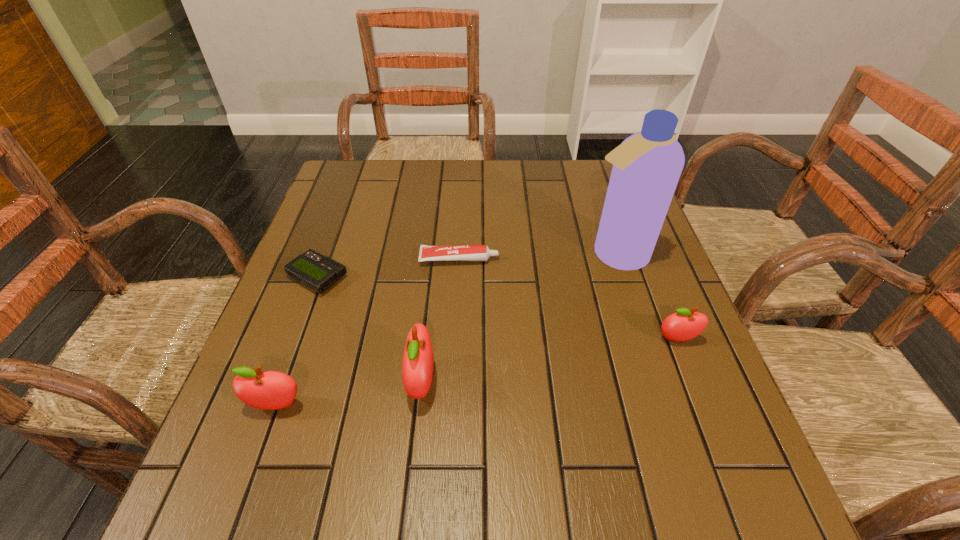
The height and width of the screenshot is (540, 960). Find the location of `vacant region located 0.380m on the back of the fifth shortest object`. vacant region located 0.380m on the back of the fifth shortest object is located at coordinates (438, 233).

Find the location of a particular element. free region located 0.330m on the back of the shortest apple is located at coordinates (x=636, y=232).

Image resolution: width=960 pixels, height=540 pixels. In order to click on vacant space positioned at the nozzle of the toothpaste in this screenshot , I will do `click(536, 259)`.

The height and width of the screenshot is (540, 960). What are the coordinates of `vacant region located 0.090m on the front of the beeper` in the screenshot? It's located at (299, 329).

Find the location of `vacant space located on the front of the shampoo`. vacant space located on the front of the shampoo is located at coordinates (633, 310).

Image resolution: width=960 pixels, height=540 pixels. Find the location of `apple at the left edge`. apple at the left edge is located at coordinates (270, 390).

At what (x,y) coordinates should I click in order to perform the action: click on beeper at the left edge. Please return your answer as a coordinate pair (x, y). Image resolution: width=960 pixels, height=540 pixels. Looking at the image, I should click on (318, 272).

Where is `apple present at the right edge`? This screenshot has height=540, width=960. apple present at the right edge is located at coordinates (684, 325).

Locate an element on the screen. shampoo that is positioned at the right edge is located at coordinates (647, 165).

Find the location of `object that is at the near left corner`. object that is at the near left corner is located at coordinates click(270, 390).